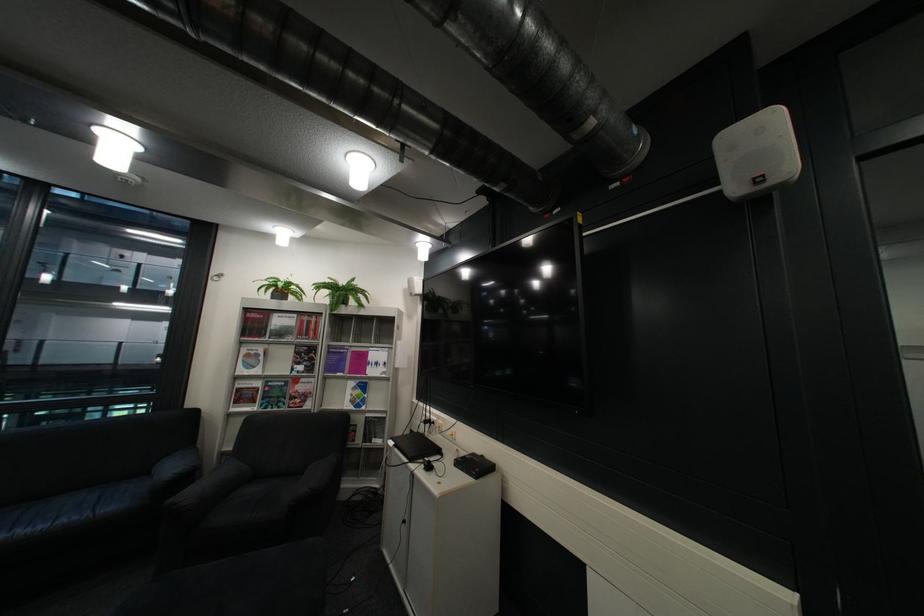
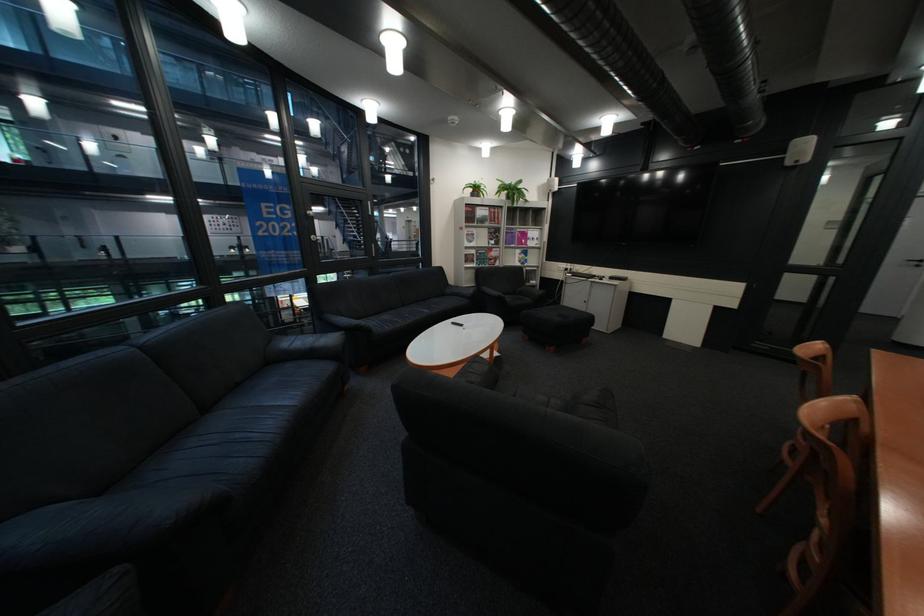
In the second image, find the point that corresponds to (261,309) in the first image.

(481, 205)